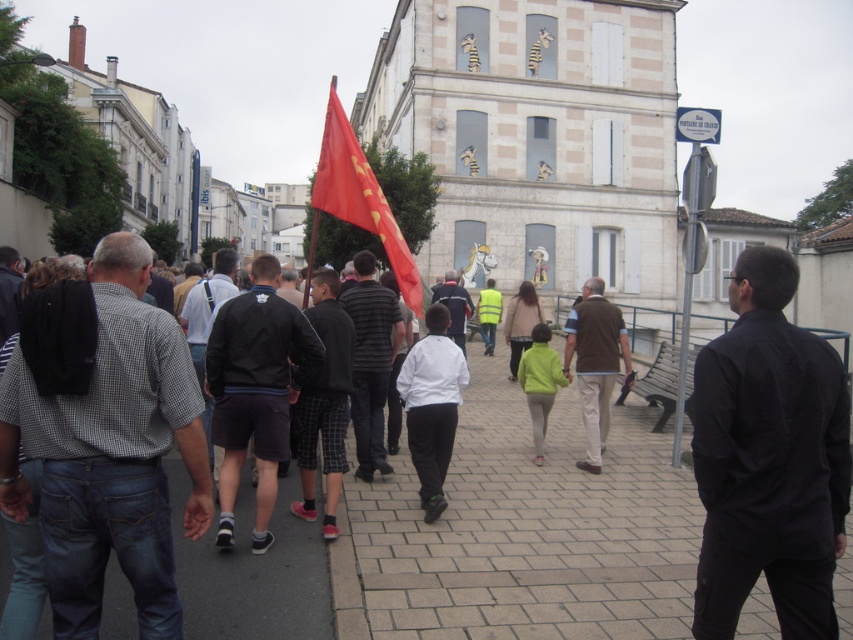
Measure the distance between point (x=349, y=198) and camera.

They are 83.55 feet apart.

Is red fabric flag at center thinner than green matte jacket at center?

Incorrect, red fabric flag at center's width is not less than green matte jacket at center's.

Describe the element at coordinates (357, 198) in the screenshot. I see `red fabric flag at center` at that location.

Locate an element on the screen. This screenshot has width=853, height=640. red fabric flag at center is located at coordinates (357, 198).

Consider the image. Which of these two, brick paved sidewalk at center or white matte jacket at center, stands shorter?

white matte jacket at center

Does brick paved sidewalk at center appear over white matte jacket at center?

No, brick paved sidewalk at center is not above white matte jacket at center.

Between point (456, 618) and point (437, 307), which one is positioned in front?

Positioned in front is point (456, 618).

The image size is (853, 640). In order to click on brick paved sidewalk at center in this screenshot , I will do `click(521, 532)`.

Locate an element on the screen. This screenshot has width=853, height=640. black matte jacket at center is located at coordinates (254, 388).

From the picture: Which is more to the left, black matte jacket at center or red fabric flag at center?

From the viewer's perspective, red fabric flag at center appears more on the left side.

At what (x,y) coordinates should I click in order to perform the action: click on black matte jacket at center. Please return your answer as a coordinate pair (x, y). This screenshot has width=853, height=640. Looking at the image, I should click on (254, 388).